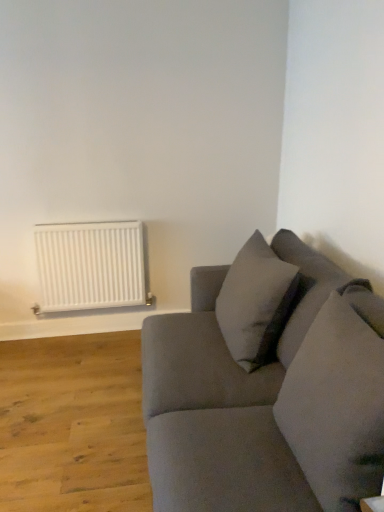
Question: Should I look upward or downward to see suede gray couch at right?

Choices:
 (A) down
 (B) up

Answer: (A)

Question: Is suede-like gray pillow at right, which is the 1th pillow in front-to-back order, inside suede gray couch at right?

Choices:
 (A) yes
 (B) no

Answer: (A)

Question: Is suede gray couch at right oriented away from suede-like gray pillow at right, which is the 2th pillow from back to front?

Choices:
 (A) no
 (B) yes

Answer: (B)

Question: Can you see suede gray couch at right touching suede-like gray pillow at right, which is the 1th pillow in front-to-back order?

Choices:
 (A) yes
 (B) no

Answer: (B)

Question: Can you confirm if suede gray couch at right is shorter than suede-like gray pillow at right, which is the 2th pillow from back to front?

Choices:
 (A) yes
 (B) no

Answer: (B)

Question: Can you confirm if suede gray couch at right is bigger than suede-like gray pillow at right, which is the 2th pillow from back to front?

Choices:
 (A) yes
 (B) no

Answer: (A)

Question: Does suede gray couch at right appear on the left side of suede-like gray pillow at right, which is the 2th pillow from back to front?

Choices:
 (A) no
 (B) yes

Answer: (B)

Question: From the image's perspective, is white matte radiator at left below suede gray couch at right?

Choices:
 (A) no
 (B) yes

Answer: (A)

Question: From a real-world perspective, is white matte radiator at left positioned over suede gray couch at right based on gravity?

Choices:
 (A) yes
 (B) no

Answer: (A)

Question: Is white matte radiator at left wider than suede gray couch at right?

Choices:
 (A) no
 (B) yes

Answer: (A)

Question: Does white matte radiator at left have a greater height compared to suede gray couch at right?

Choices:
 (A) no
 (B) yes

Answer: (A)

Question: Is white matte radiator at left at the right side of suede gray couch at right?

Choices:
 (A) yes
 (B) no

Answer: (B)

Question: Is white matte radiator at left behind suede gray couch at right?

Choices:
 (A) yes
 (B) no

Answer: (A)

Question: Is soft gray pillow at upper right, arranged as the 2th pillow when viewed from the front, located within white matte radiator at left?

Choices:
 (A) yes
 (B) no

Answer: (B)